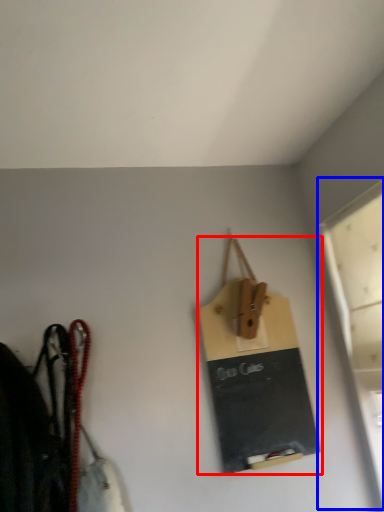
Question: Which point is further to the camera, handbag (highlighted by a red box) or window (highlighted by a blue box)?

Choices:
 (A) handbag
 (B) window

Answer: (A)